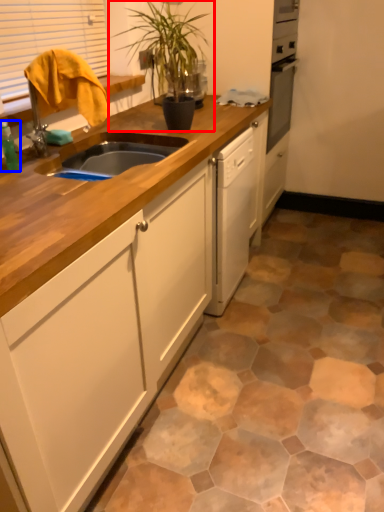
Question: Which point is closer to the camera, houseplant (highlighted by a red box) or bottle (highlighted by a blue box)?

Choices:
 (A) houseplant
 (B) bottle

Answer: (B)